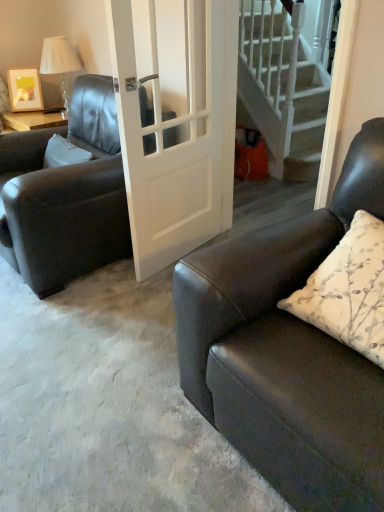
Question: Is matte black couch at right aimed at matte black leather chair at left?

Choices:
 (A) no
 (B) yes

Answer: (A)

Question: Considering the relative sizes of matte black couch at right and matte black leather chair at left in the image provided, is matte black couch at right thinner than matte black leather chair at left?

Choices:
 (A) no
 (B) yes

Answer: (A)

Question: From a real-world perspective, is matte black couch at right below matte black leather chair at left?

Choices:
 (A) no
 (B) yes

Answer: (A)

Question: Considering the relative sizes of matte black couch at right and matte black leather chair at left in the image provided, is matte black couch at right bigger than matte black leather chair at left?

Choices:
 (A) no
 (B) yes

Answer: (A)

Question: From a real-world perspective, is matte black couch at right physically above matte black leather chair at left?

Choices:
 (A) no
 (B) yes

Answer: (B)

Question: Is the depth of matte black couch at right less than that of matte black leather chair at left?

Choices:
 (A) no
 (B) yes

Answer: (B)

Question: Would you say matte black couch at right is outside white fabric lampshade at upper left?

Choices:
 (A) no
 (B) yes

Answer: (B)

Question: Considering the relative sizes of matte black couch at right and white fabric lampshade at upper left in the image provided, is matte black couch at right taller than white fabric lampshade at upper left?

Choices:
 (A) yes
 (B) no

Answer: (A)

Question: From the image's perspective, is matte black couch at right located above white fabric lampshade at upper left?

Choices:
 (A) no
 (B) yes

Answer: (A)

Question: Is matte black couch at right at the right side of white fabric lampshade at upper left?

Choices:
 (A) yes
 (B) no

Answer: (A)

Question: Does matte black couch at right have a smaller size compared to white fabric lampshade at upper left?

Choices:
 (A) yes
 (B) no

Answer: (B)

Question: Would you say matte black couch at right is a long distance from white fabric lampshade at upper left?

Choices:
 (A) no
 (B) yes

Answer: (B)

Question: Would you say matte black couch at right is outside white glossy door at center?

Choices:
 (A) no
 (B) yes

Answer: (B)